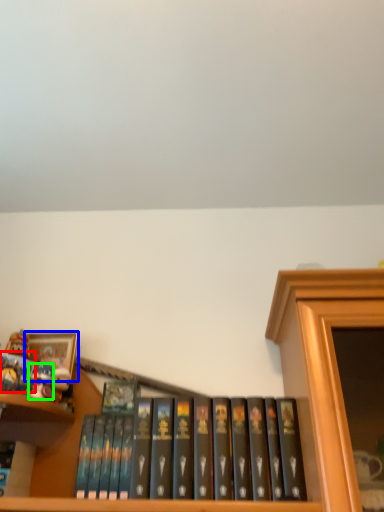
Question: Which object is the farthest from book (highlighted by a red box)? Choose among these: picture frame (highlighted by a blue box) or toy (highlighted by a green box).

Choices:
 (A) picture frame
 (B) toy

Answer: (A)